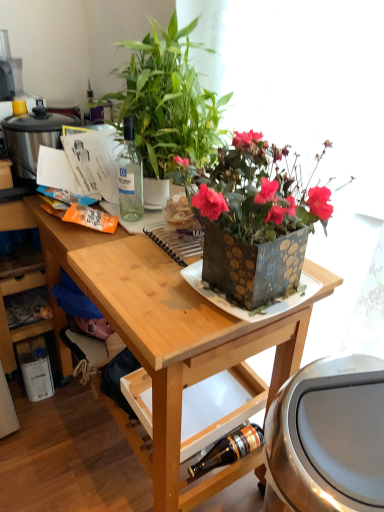
I want to click on free space in front of transparent glass bottle at upper left, the 2th bottle from the right, so click(x=118, y=233).